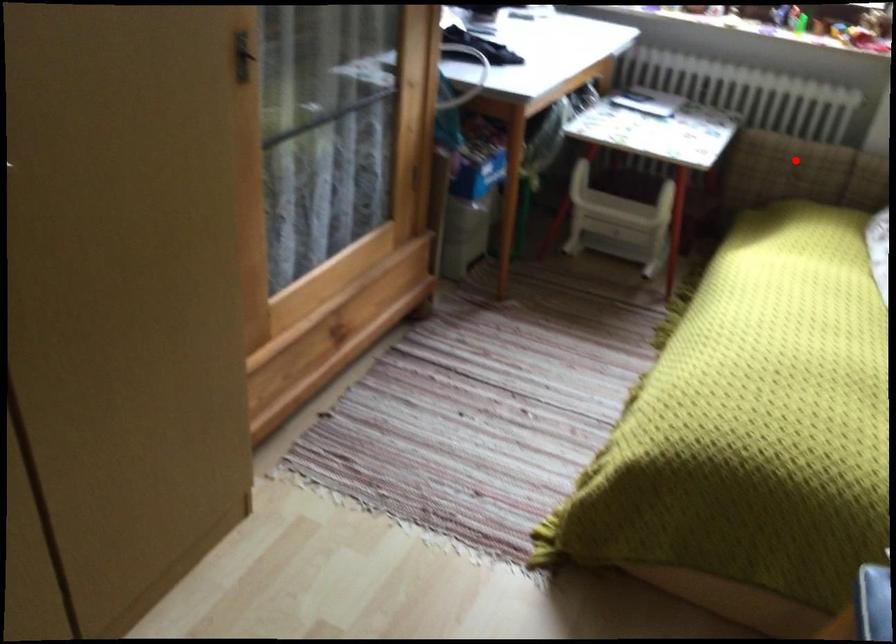
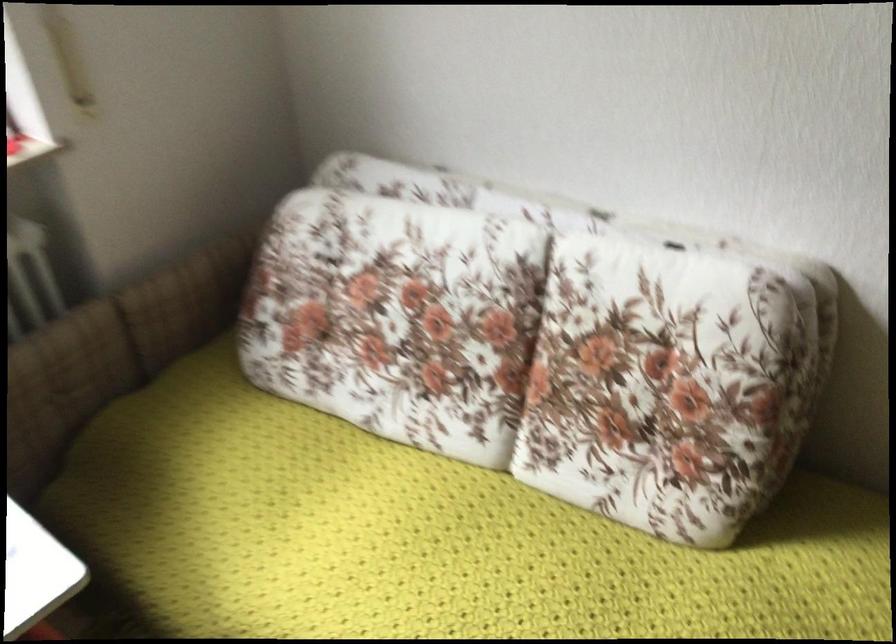
The point at the highlighted location is marked in the first image. Where is the corresponding point in the second image?

(63, 384)